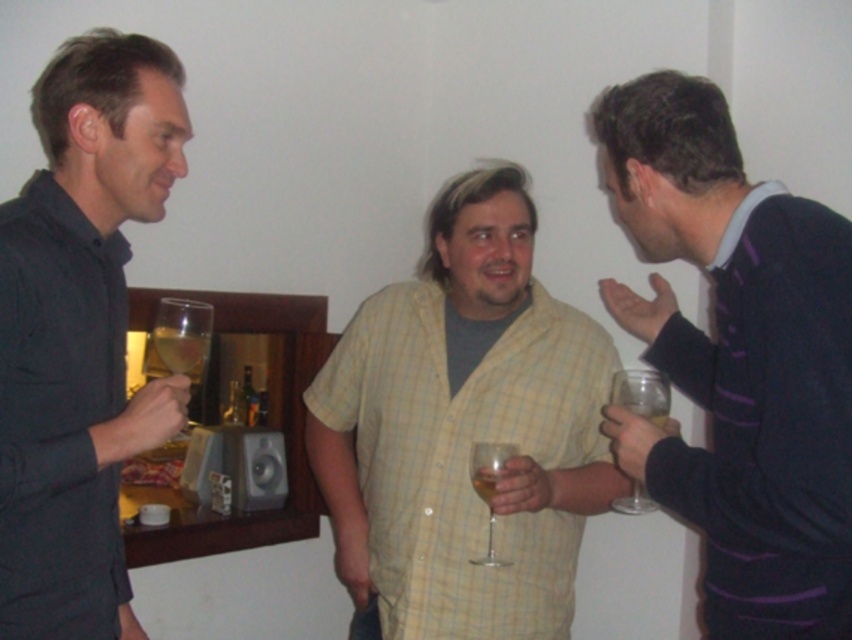
You are a photographer trying to capture a candid shot of the dark gray shirt at left and the clear glass wine glass at center. Since you want to ensure both are in focus, you need to know their heights. Which object is taller?

The dark gray shirt at left is much taller than the clear glass wine glass at center, so the dark gray shirt at left is taller.